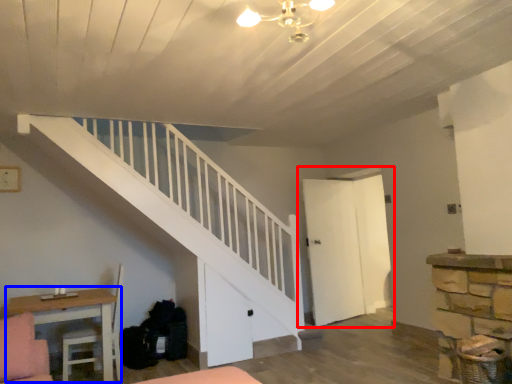
Question: Among these objects, which one is farthest to the camera, door (highlighted by a red box) or table (highlighted by a blue box)?

Choices:
 (A) door
 (B) table

Answer: (A)